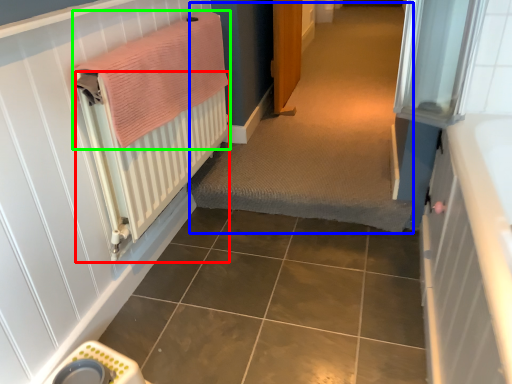
Question: Based on their relative distances, which object is farther from radiator (highlighted by a red box)? Choose from plain (highlighted by a blue box) and bath towel (highlighted by a green box).

Choices:
 (A) plain
 (B) bath towel

Answer: (A)